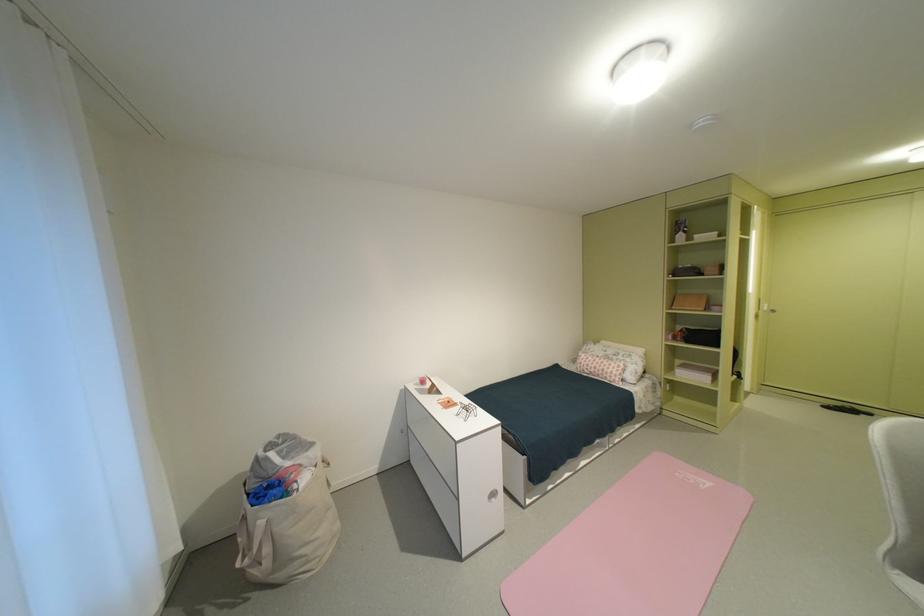
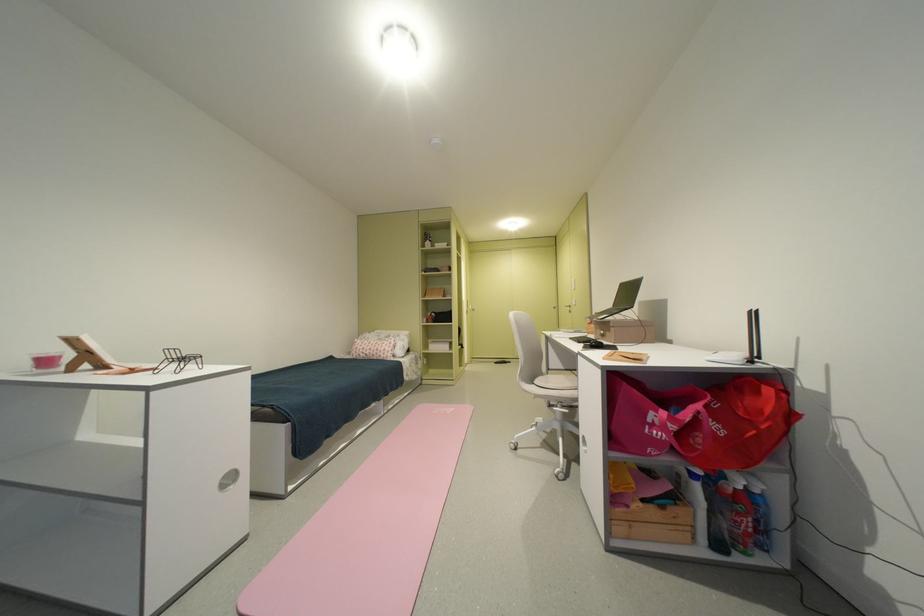
Where in the second image is the point corresponding to pixel 502 493 from the first image?

(237, 477)